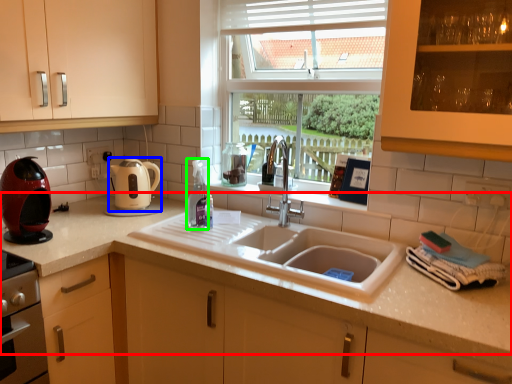
Question: Considering the real-world distances, which object is farthest from countertop (highlighted by a red box)? kitchen appliance (highlighted by a blue box) or bottle (highlighted by a green box)?

Choices:
 (A) kitchen appliance
 (B) bottle

Answer: (B)